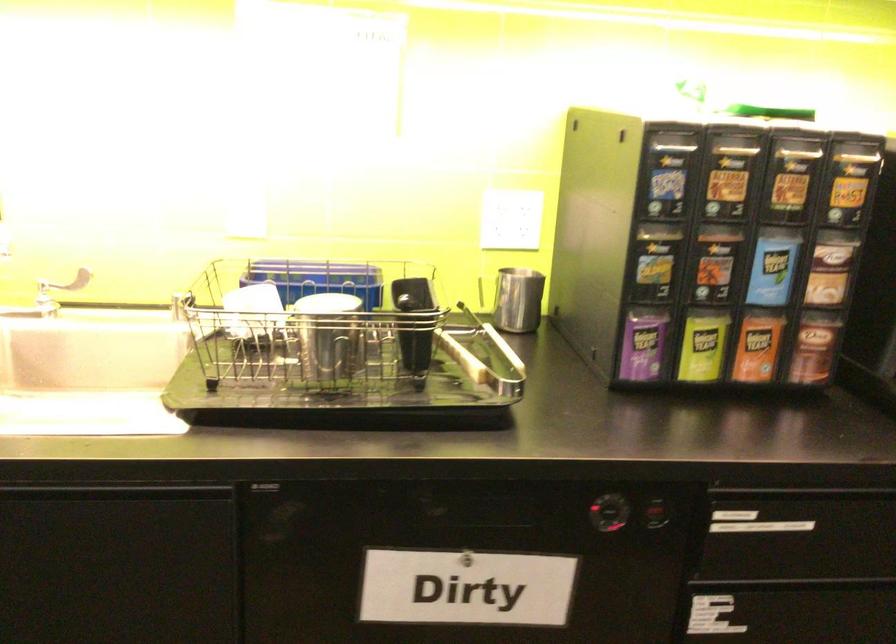
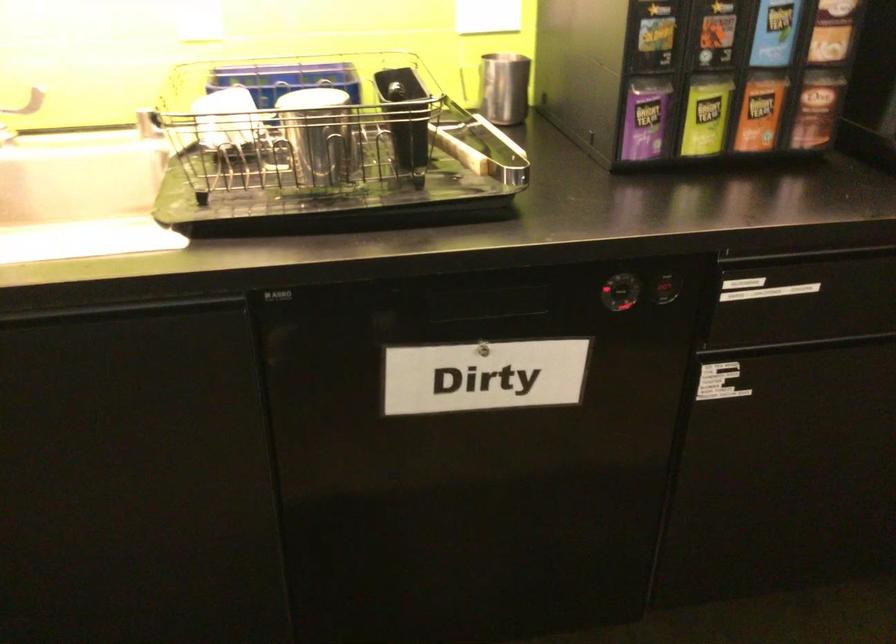
Locate, in the second image, the point that corresponds to (328,336) in the first image.

(319, 134)